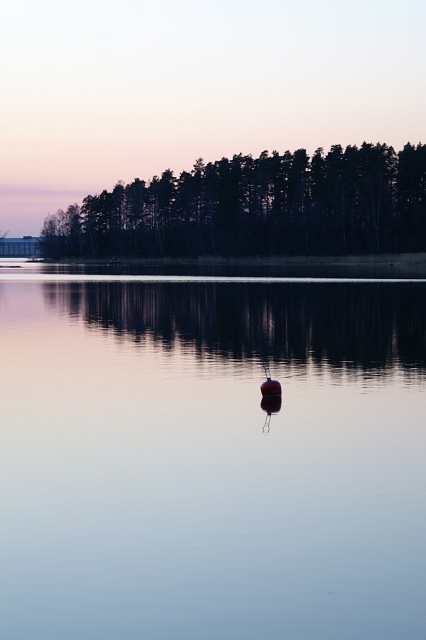
You are a boat captain trying to navigate through the smooth water at center and the smooth red buoy at center. Which path is wider for your boat to pass through?

The smooth water at center is wider than the smooth red buoy at center, so the path through the smooth water at center is wider and suitable for the boat to pass through.